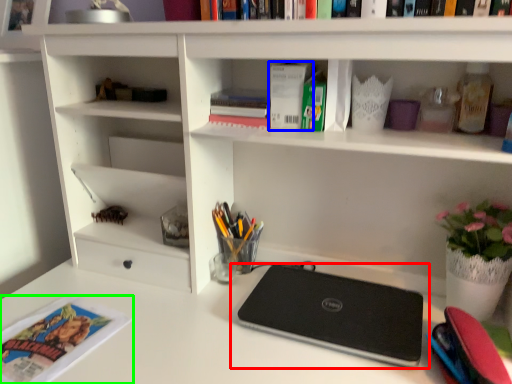
Question: Estimate the real-world distances between objects in this image. Which object is closer to laptop (highlighted by a red box), paperback book (highlighted by a blue box) or magazine (highlighted by a green box)?

Choices:
 (A) paperback book
 (B) magazine

Answer: (A)